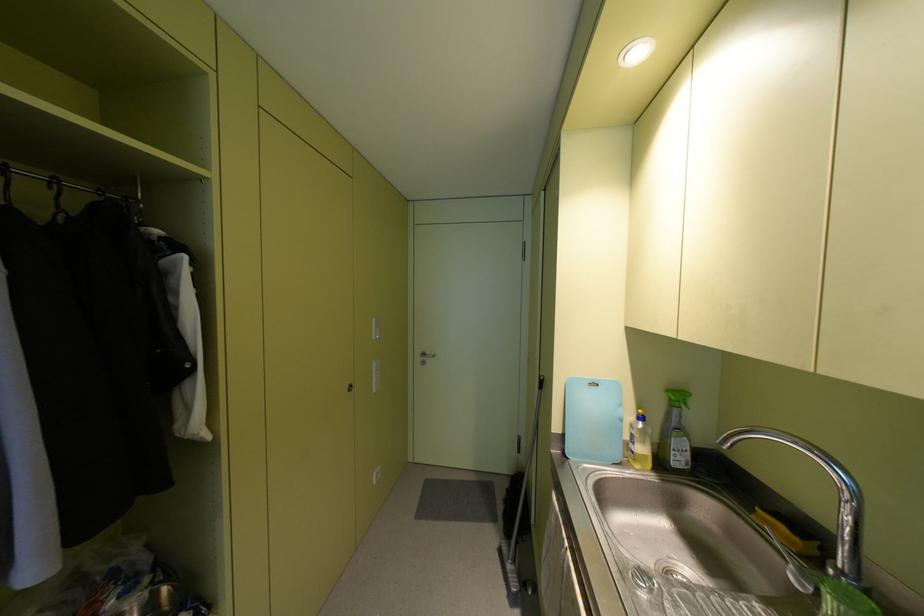
The width and height of the screenshot is (924, 616). Describe the element at coordinates (592, 419) in the screenshot. I see `a blue cutting board` at that location.